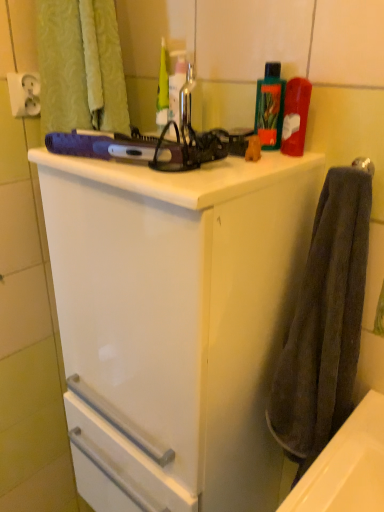
Question: From a real-world perspective, is green plastic bottle at upper right positioned under translucent plastic bottle at upper center based on gravity?

Choices:
 (A) yes
 (B) no

Answer: (A)

Question: From a real-world perspective, does green plastic bottle at upper right stand above translucent plastic bottle at upper center?

Choices:
 (A) no
 (B) yes

Answer: (A)

Question: Is green plastic bottle at upper right wider than translucent plastic bottle at upper center?

Choices:
 (A) yes
 (B) no

Answer: (B)

Question: Is green plastic bottle at upper right with translucent plastic bottle at upper center?

Choices:
 (A) yes
 (B) no

Answer: (B)

Question: From the image's perspective, is green plastic bottle at upper right under translucent plastic bottle at upper center?

Choices:
 (A) no
 (B) yes

Answer: (B)

Question: Looking at their shapes, would you say metallic silver faucet at upper center is wider or thinner than white plastic socket at upper left?

Choices:
 (A) thin
 (B) wide

Answer: (B)

Question: From the image's perspective, is metallic silver faucet at upper center positioned above or below white plastic socket at upper left?

Choices:
 (A) above
 (B) below

Answer: (B)

Question: In the image, is metallic silver faucet at upper center on the left side or the right side of white plastic socket at upper left?

Choices:
 (A) left
 (B) right

Answer: (B)

Question: Choose the correct answer: Is metallic silver faucet at upper center inside white plastic socket at upper left or outside it?

Choices:
 (A) outside
 (B) inside

Answer: (A)

Question: Visually, is dark gray towel at right positioned to the left or to the right of metallic silver faucet at upper center?

Choices:
 (A) right
 (B) left

Answer: (A)

Question: Is dark gray towel at right wider or thinner than metallic silver faucet at upper center?

Choices:
 (A) thin
 (B) wide

Answer: (B)

Question: From the image's perspective, is dark gray towel at right positioned above or below metallic silver faucet at upper center?

Choices:
 (A) above
 (B) below

Answer: (B)

Question: Is point (319, 305) closer or farther from the camera than point (188, 62)?

Choices:
 (A) farther
 (B) closer

Answer: (B)

Question: Looking at their shapes, would you say green plastic bottle at upper right is wider or thinner than translucent plastic bottle at upper center?

Choices:
 (A) thin
 (B) wide

Answer: (A)

Question: Visually, is green plastic bottle at upper right positioned to the left or to the right of translucent plastic bottle at upper center?

Choices:
 (A) left
 (B) right

Answer: (B)